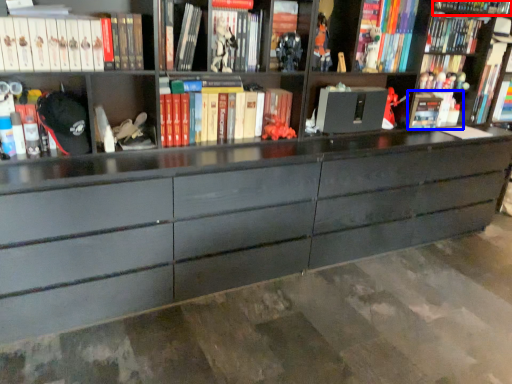
Question: Among these objects, which one is nearest to the camera, book (highlighted by a red box) or book (highlighted by a blue box)?

Choices:
 (A) book
 (B) book

Answer: (A)